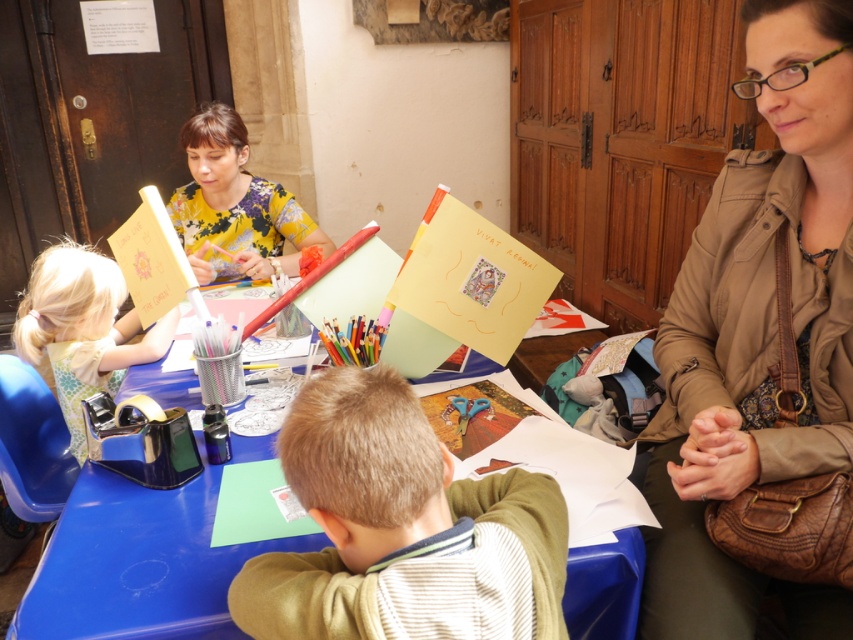
Question: Which of the following is the closest to the observer?

Choices:
 (A) light brown hair at center
 (B) yellow floral blouse at upper left
 (C) blue plastic table at center

Answer: (A)

Question: Which object is closer to the camera taking this photo?

Choices:
 (A) blue plastic table at center
 (B) matte yellow card at left
 (C) brown leather jacket at upper right
 (D) yellow floral blouse at upper left

Answer: (A)

Question: Does brown leather jacket at upper right appear on the right side of matte yellow card at left?

Choices:
 (A) no
 (B) yes

Answer: (B)

Question: Is brown leather jacket at upper right to the left of matte yellow card at left from the viewer's perspective?

Choices:
 (A) no
 (B) yes

Answer: (A)

Question: Does blue plastic table at center appear on the right side of matte yellow card at left?

Choices:
 (A) yes
 (B) no

Answer: (A)

Question: Estimate the real-world distances between objects in this image. Which object is farther from the yellow floral blouse at upper left?

Choices:
 (A) light brown hair at center
 (B) blue plastic table at center

Answer: (A)